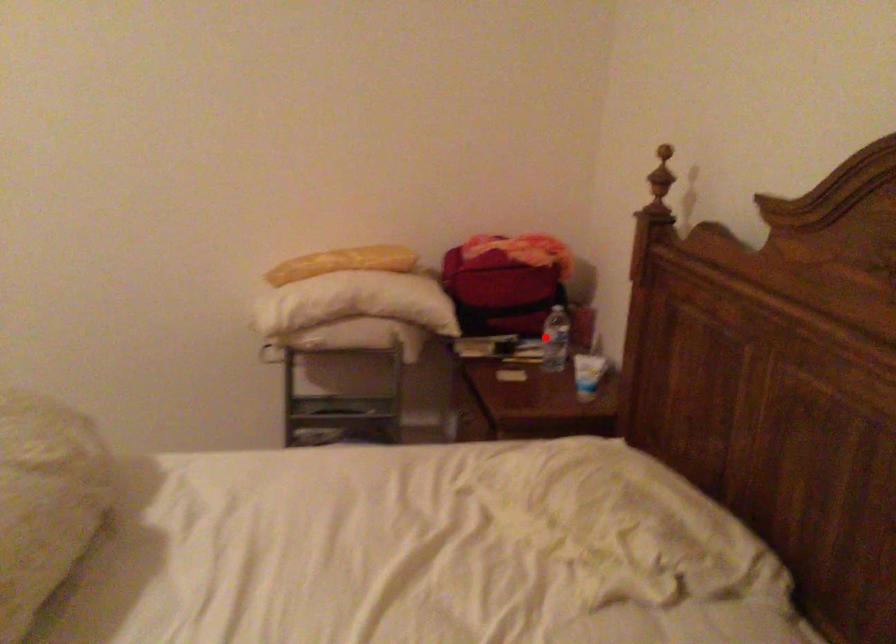
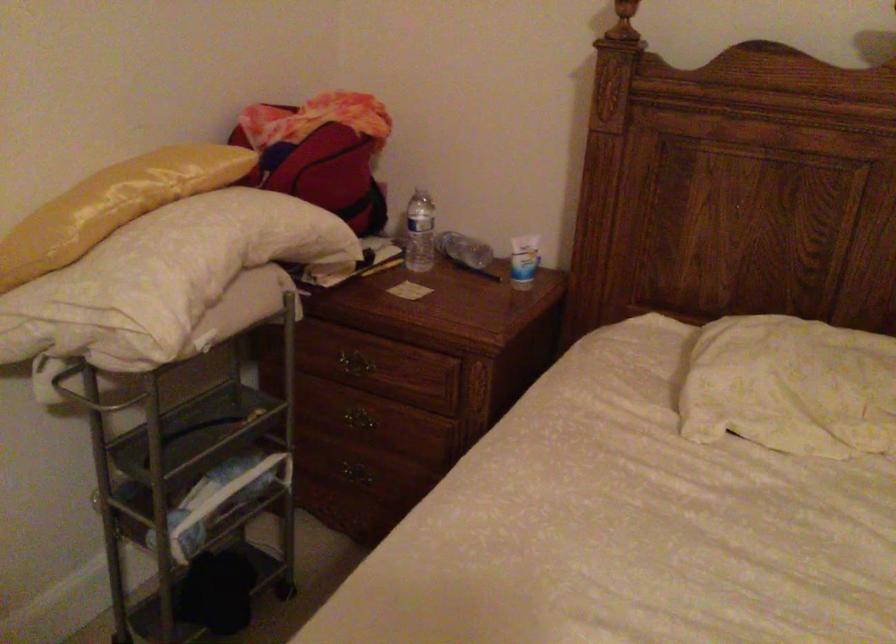
The point at the highlighted location is marked in the first image. Where is the corresponding point in the second image?

(419, 232)